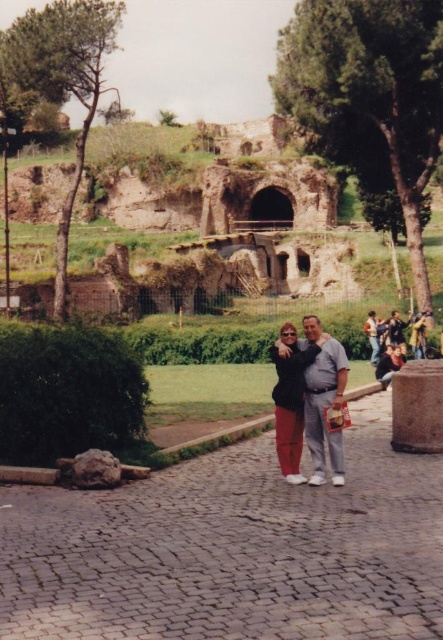
You are a photographer adjusting your camera to capture the couple on the archaeological site. You want to focus on the person wearing the leather jacket at center without blurring the smooth gray shirt at right. Is this possible given their positions?

The leather jacket at center is closer to the viewer than the smooth gray shirt at right. Since the two are at different distances, it might be challenging to keep both in focus simultaneously. However, using a small aperture or adjusting the focus point could help achieve a deeper depth of field to include both subjects.

You are a photographer standing at the archaeological site. You notice a point marked at coordinates (291, 401) in the image. What object is located at that point?

The point at coordinates (291, 401) indicates the location of the matte black jacket at center.